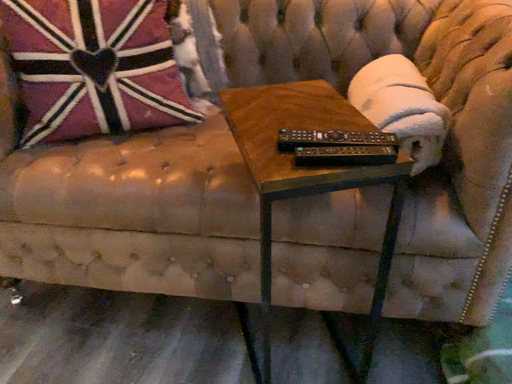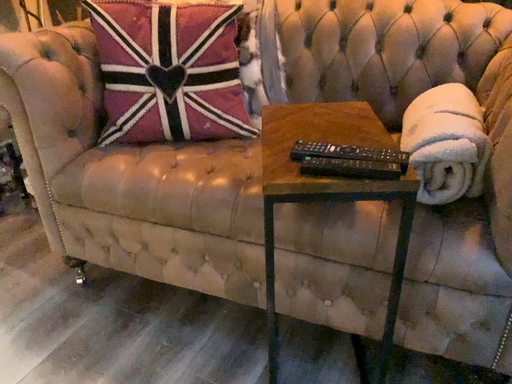
Question: Which way did the camera rotate in the video?

Choices:
 (A) rotated left
 (B) rotated right

Answer: (A)